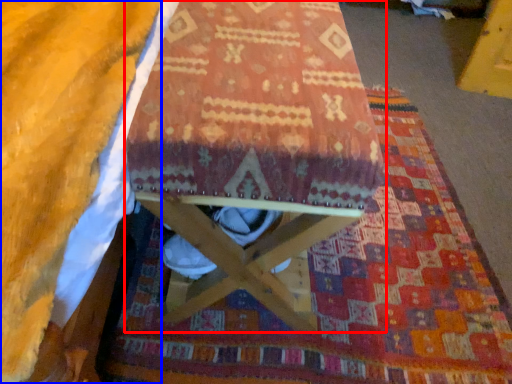
Question: Which object is closer to the camera taking this photo, furniture (highlighted by a red box) or blanket (highlighted by a blue box)?

Choices:
 (A) furniture
 (B) blanket

Answer: (B)